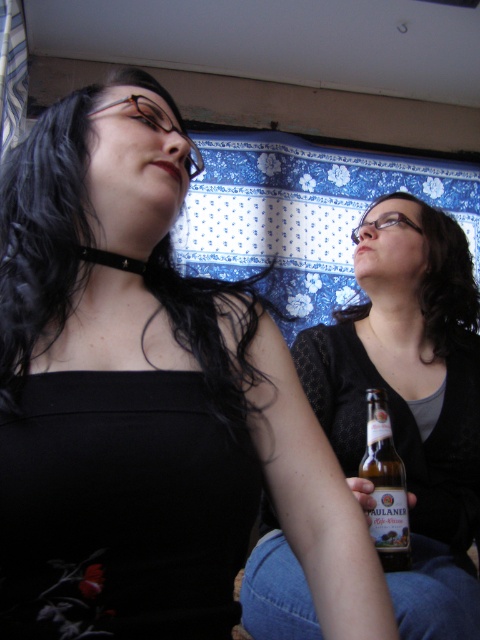
Question: Among these points, which one is nearest to the camera?

Choices:
 (A) (383, 451)
 (B) (400, 250)

Answer: (A)

Question: Which is nearer to the matte black hair at upper right?

Choices:
 (A) golden glass beer bottle at center
 (B) matte black shirt at center

Answer: (B)

Question: From the image, what is the correct spatial relationship of matte black hair at upper right in relation to golden glass beer bottle at center?

Choices:
 (A) left
 (B) right

Answer: (B)

Question: Does matte black shirt at center have a lesser width compared to matte black hair at upper right?

Choices:
 (A) yes
 (B) no

Answer: (B)

Question: Which point is closer to the camera taking this photo?

Choices:
 (A) (387, 563)
 (B) (430, 269)

Answer: (A)

Question: Where is matte black hair at upper right located in relation to golden glass beer bottle at center in the image?

Choices:
 (A) above
 (B) below

Answer: (A)